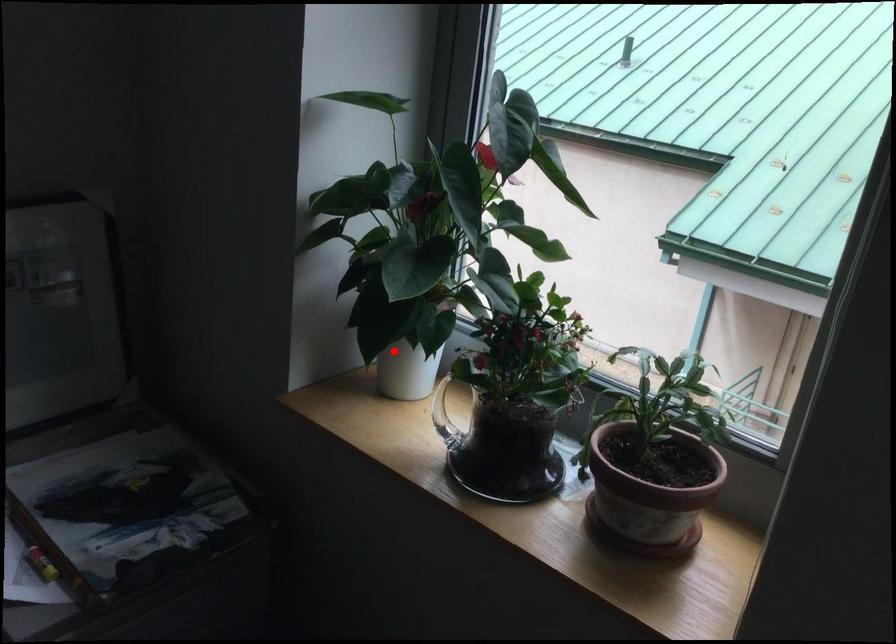
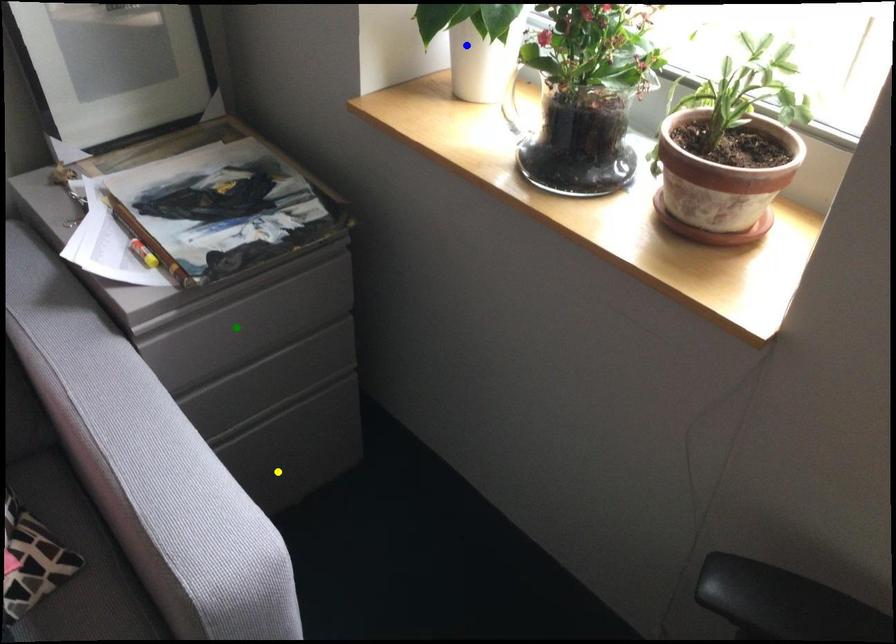
Question: I am providing you with two images of the same scene from different viewpoints. A red point is marked on the first image. You are given multiple points on the second image. Can you choose the point in image 2 that corresponds to the point in image 1?

Choices:
 (A) green point
 (B) blue point
 (C) yellow point

Answer: (B)